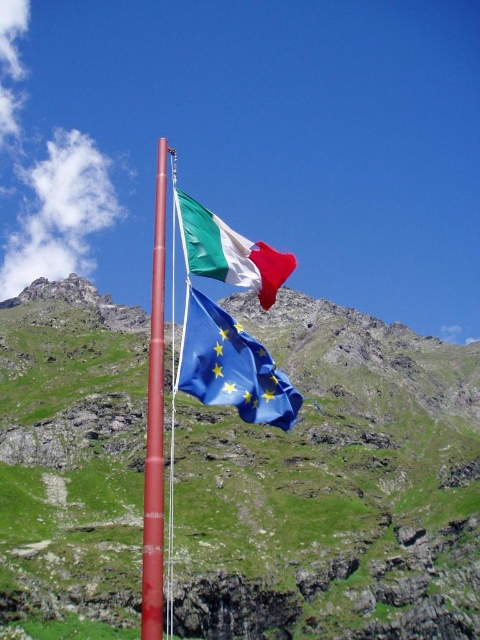
Who is higher up, green grassy mountain at upper center or smooth red pole at center?

smooth red pole at center

Does green grassy mountain at upper center have a larger size compared to smooth red pole at center?

Actually, green grassy mountain at upper center might be smaller than smooth red pole at center.

What are the coordinates of `green grassy mountain at upper center` in the screenshot? It's located at (335, 486).

Is point (259, 364) closer to viewer compared to point (186, 202)?

Yes, it is.

Can you confirm if blue fabric flag at upper center is positioned to the right of matte fabric flag at upper center?

Incorrect, blue fabric flag at upper center is not on the right side of matte fabric flag at upper center.

Is point (273, 396) closer to viewer compared to point (251, 260)?

Yes, point (273, 396) is in front of point (251, 260).

The height and width of the screenshot is (640, 480). Find the location of `blue fabric flag at upper center`. blue fabric flag at upper center is located at coordinates pos(231,365).

Between blue fabric flag at upper center and smooth red pole at center, which one appears on the left side from the viewer's perspective?

smooth red pole at center is more to the left.

Between point (222, 326) and point (147, 541), which one is positioned in front?

Point (147, 541)

The image size is (480, 640). Find the location of `blue fabric flag at upper center`. blue fabric flag at upper center is located at coordinates (231, 365).